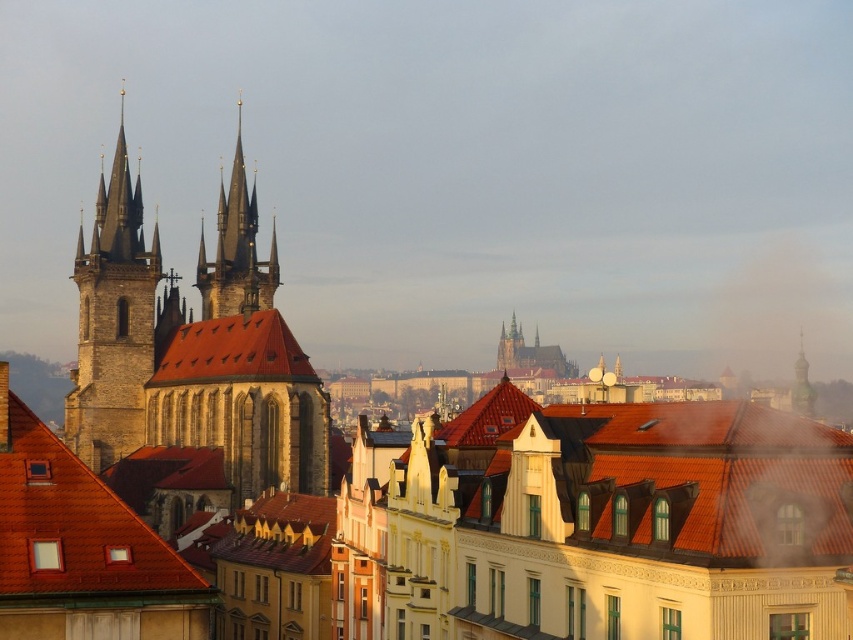
Who is positioned more to the left, brown tile roof at center or golden stone spire at center?

brown tile roof at center

Is brown tile roof at center to the left of golden stone spire at center from the viewer's perspective?

Correct, you'll find brown tile roof at center to the left of golden stone spire at center.

Where is `brown tile roof at center`? This screenshot has height=640, width=853. brown tile roof at center is located at coordinates (231, 352).

In order to click on brown tile roof at center in this screenshot , I will do `click(231, 352)`.

Is brown stone church at left to the right of brown tile roof at center from the viewer's perspective?

Incorrect, brown stone church at left is not on the right side of brown tile roof at center.

Between point (117, 401) and point (234, 358), which one is positioned in front?

Point (234, 358) is in front.

Is point (119, 248) closer to viewer compared to point (221, 381)?

No.

What are the coordinates of `brown stone church at left` in the screenshot? It's located at (190, 348).

Does point (68, 506) come closer to viewer compared to point (798, 362)?

That is True.

Is brown tile roof at lower left to the left of gold textured spire at upper right from the viewer's perspective?

Correct, you'll find brown tile roof at lower left to the left of gold textured spire at upper right.

Which is in front, point (177, 580) or point (799, 381)?

Point (177, 580) is in front.

The image size is (853, 640). What are the coordinates of `brown tile roof at lower left` in the screenshot? It's located at (73, 524).